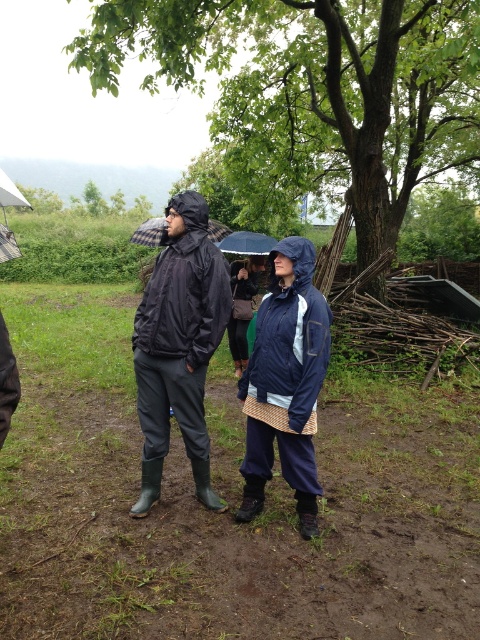
Between navy blue waterproof jacket at center and white matte umbrella at upper left, which one appears on the right side from the viewer's perspective?

navy blue waterproof jacket at center

The image size is (480, 640). What are the coordinates of `navy blue waterproof jacket at center` in the screenshot? It's located at (286, 381).

This screenshot has height=640, width=480. I want to click on green leafy tree at upper center, so click(312, 92).

Can you confirm if green leafy tree at upper center is positioned to the left of matte black jacket at center?

Result: Incorrect, green leafy tree at upper center is not on the left side of matte black jacket at center.

The width and height of the screenshot is (480, 640). What do you see at coordinates (312, 92) in the screenshot?
I see `green leafy tree at upper center` at bounding box center [312, 92].

At what (x,y) coordinates should I click in order to perform the action: click on green leafy tree at upper center. Please return your answer as a coordinate pair (x, y). Image resolution: width=480 pixels, height=640 pixels. Looking at the image, I should click on (312, 92).

Is matte black jacket at center positioned at the back of navy blue waterproof jacket at center?

Yes, it is.

Does point (204, 470) come in front of point (256, 352)?

No, (204, 470) is further to viewer.

The width and height of the screenshot is (480, 640). In order to click on matte black jacket at center in this screenshot , I will do (x=179, y=346).